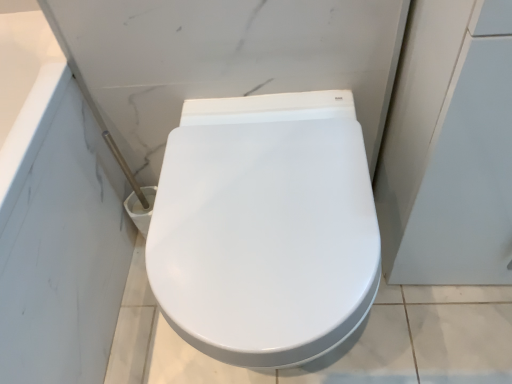
What are the coordinates of `white glossy toilet at center` in the screenshot? It's located at (265, 227).

Describe the element at coordinates (265, 227) in the screenshot. I see `white glossy toilet at center` at that location.

At what (x,y) coordinates should I click in order to perform the action: click on white glossy toilet at center. Please return your answer as a coordinate pair (x, y). This screenshot has height=384, width=512. Looking at the image, I should click on (265, 227).